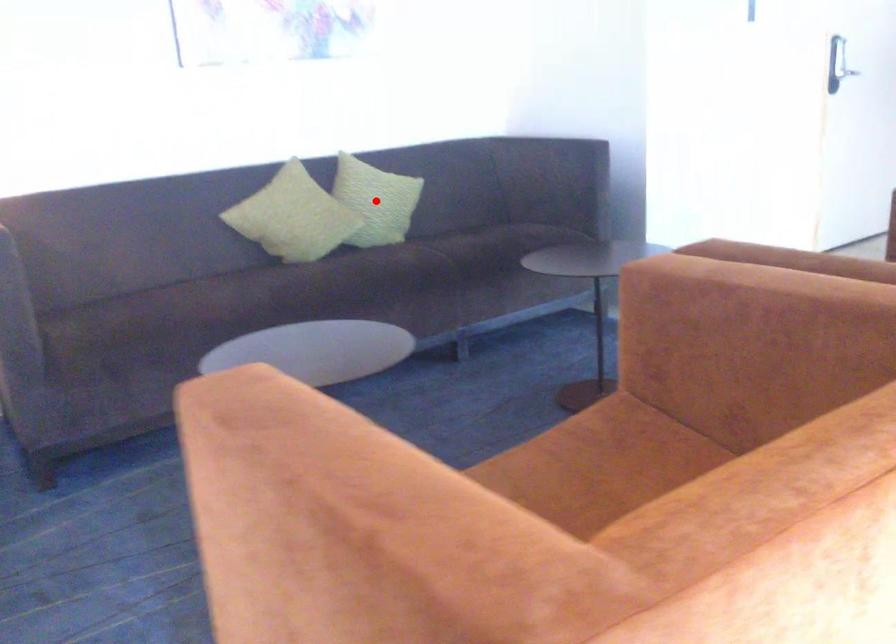
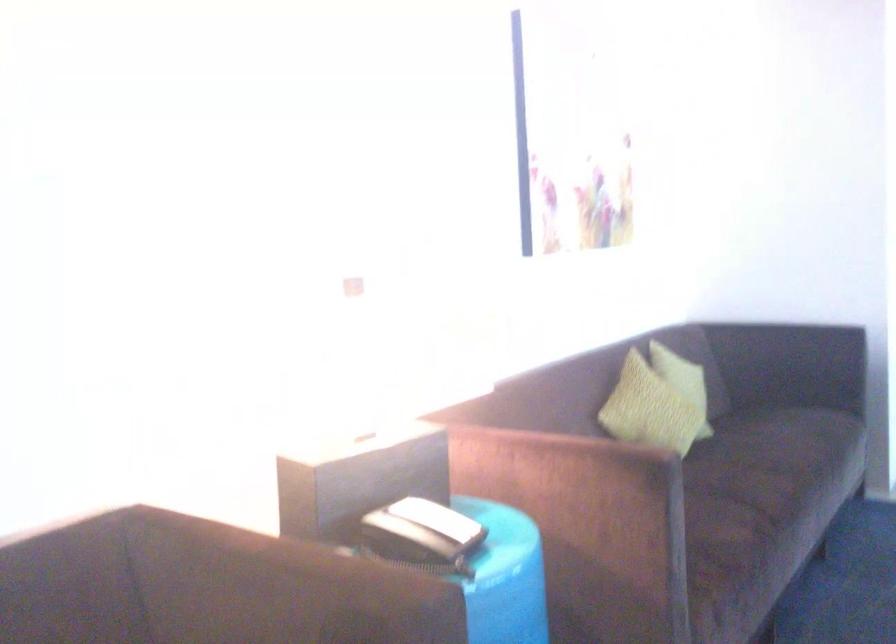
Question: I am providing you with two images of the same scene from different viewpoints. A red point is marked on the first image. Is the red point's position out of view in image 2?

Choices:
 (A) Yes
 (B) No

Answer: (A)